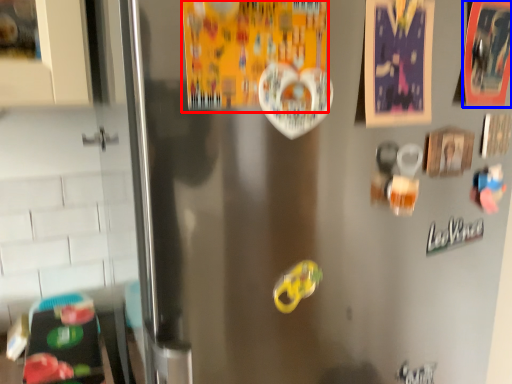
Question: Which object is closer to the camera taking this photo, postcard (highlighted by a red box) or postcard (highlighted by a blue box)?

Choices:
 (A) postcard
 (B) postcard

Answer: (A)